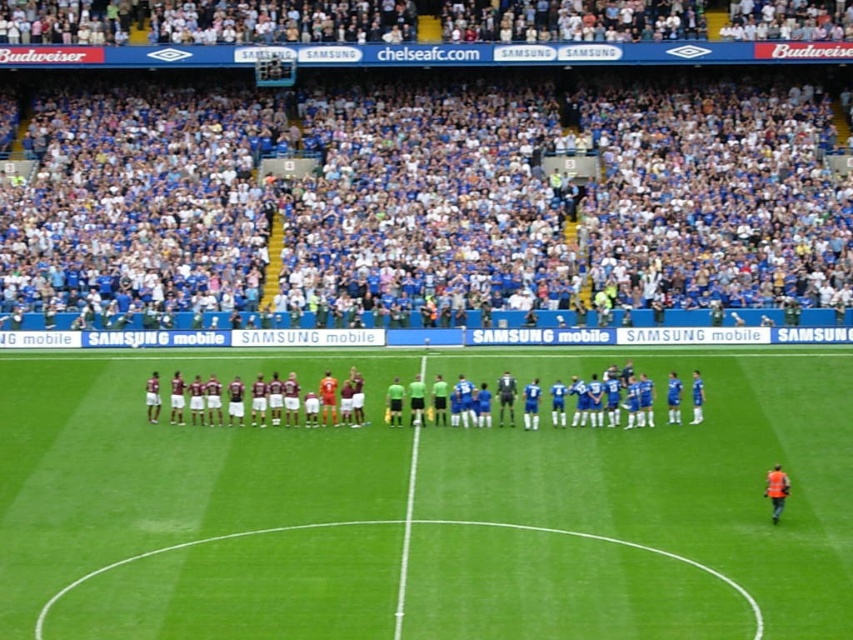
You are a photographer standing at the edge of the field. You want to take a photo that includes both the green grass football field at center and the green grass line at center. Which object will appear taller in the photo?

The green grass football field at center will appear taller in the photo because it has a greater height compared to the green grass line at center.

You are a drone operator trying to capture a shot of the green grass football field at center and the blue fabric crowd at upper center. Which object should you focus on if you want to capture the one that is closer to the ground?

The green grass football field at center is closer to the ground because it is shorter than the blue fabric crowd at upper center.